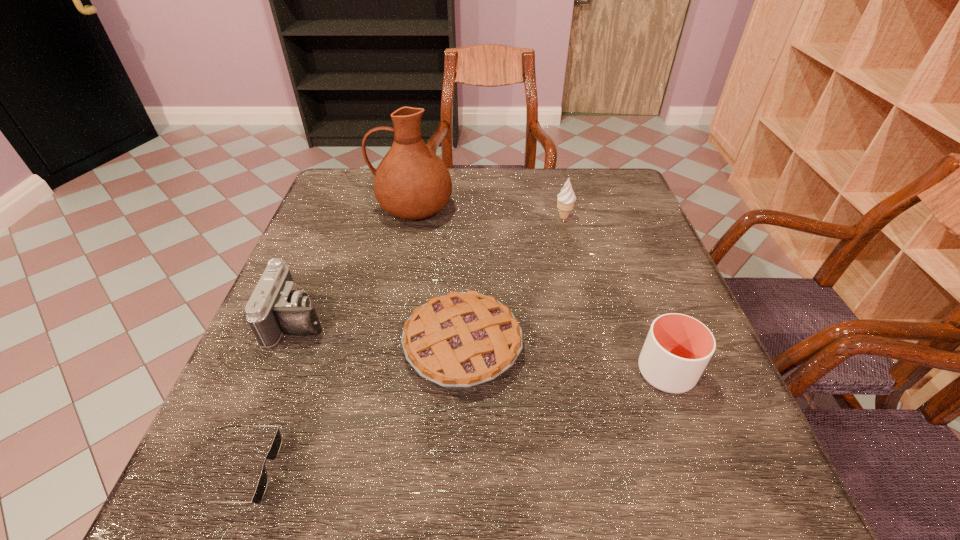
At what (x,y) coordinates should I click in order to perform the action: click on free spot between the pie and the sunglasses. Please return your answer as a coordinate pair (x, y). This screenshot has height=540, width=960. Looking at the image, I should click on (351, 408).

Where is `free space that is in between the rightmost object and the icecream`? The image size is (960, 540). free space that is in between the rightmost object and the icecream is located at coordinates (614, 295).

This screenshot has height=540, width=960. I want to click on free space between the fifth tallest object and the camera, so click(x=381, y=332).

Identify the location of free space between the icecream and the pitcher. This screenshot has height=540, width=960. point(489,213).

Identify the location of free space between the shortest object and the camera. The width and height of the screenshot is (960, 540). (270, 395).

Image resolution: width=960 pixels, height=540 pixels. I want to click on vacant space in between the pie and the tallest object, so coord(438,277).

Identify the location of vacant area that lies between the fifth tallest object and the pitcher. The width and height of the screenshot is (960, 540). (438, 277).

Locate an element on the screen. free point between the second object from right to left and the fifth tallest object is located at coordinates (514, 281).

What are the coordinates of `empty space between the pitcher and the rightmost object` in the screenshot? It's located at (540, 290).

Find the location of a particular element. This screenshot has width=960, height=540. vacant space that is in between the second shortest object and the camera is located at coordinates (381, 332).